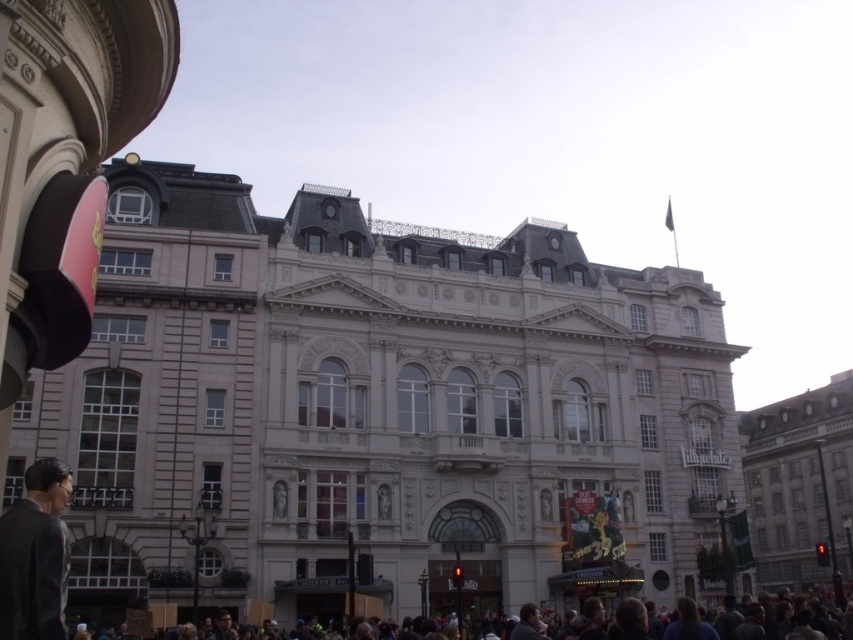
Question: Estimate the real-world distances between objects in this image. Which object is farther from the matte black glasses at lower center?

Choices:
 (A) dark gray suit at lower left
 (B) dark gray clothing at lower center

Answer: (A)

Question: Which point is closer to the camera?

Choices:
 (A) dark gray suit at lower left
 (B) matte black glasses at lower center

Answer: (A)

Question: Which point is farther to the camera?

Choices:
 (A) matte black glasses at lower center
 (B) dark gray clothing at lower center

Answer: (A)

Question: In this image, where is dark gray suit at lower left located relative to matte black glasses at lower center?

Choices:
 (A) left
 (B) right

Answer: (A)

Question: In this image, where is dark gray clothing at lower center located relative to matte black glasses at lower center?

Choices:
 (A) right
 (B) left

Answer: (A)

Question: Does dark gray clothing at lower center appear under matte black glasses at lower center?

Choices:
 (A) no
 (B) yes

Answer: (B)